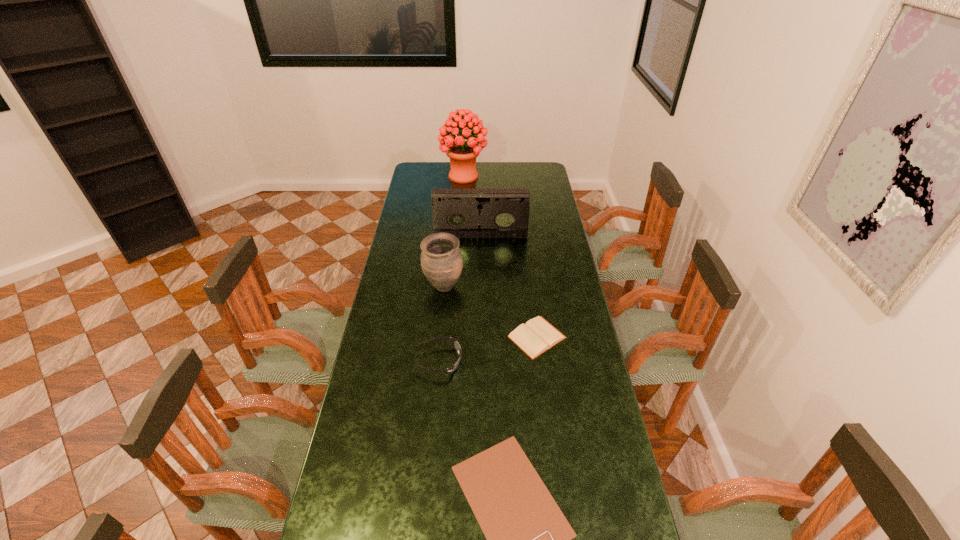
Find the location of `vacant space situated on the right of the diary`. vacant space situated on the right of the diary is located at coordinates (583, 337).

What are the coordinates of `object that is at the far edge` in the screenshot? It's located at (462, 154).

The width and height of the screenshot is (960, 540). Identify the location of object present at the right edge. (536, 336).

At what (x,y) coordinates should I click in order to perform the action: click on vacant space at the far edge of the desktop. Please return your answer as a coordinate pair (x, y). This screenshot has width=960, height=540. Looking at the image, I should click on (448, 171).

Where is `vacant region at the left edge of the desktop`? vacant region at the left edge of the desktop is located at coordinates (383, 413).

In order to click on free space at the right edge of the desktop in this screenshot , I will do `click(540, 242)`.

Where is `vacant space at the far left corner`? vacant space at the far left corner is located at coordinates (420, 167).

This screenshot has height=540, width=960. Find the location of `vacant area between the diary and the fourth nearest object`. vacant area between the diary and the fourth nearest object is located at coordinates (491, 312).

This screenshot has height=540, width=960. I want to click on free space between the diary and the videotape, so click(x=509, y=286).

At what (x,y) coordinates should I click in order to perform the action: click on free spot between the bouquet and the fifth tallest object. Please return your answer as a coordinate pair (x, y). Image resolution: width=960 pixels, height=540 pixels. Looking at the image, I should click on (500, 256).